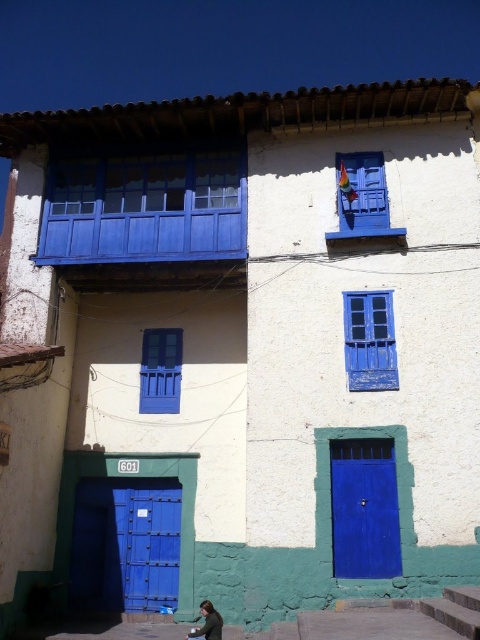
Question: Which is nearer to the matte blue wooden balcony at upper left?

Choices:
 (A) blue painted wood window at center
 (B) blue painted wood window at upper center
 (C) metallic blue door at lower left

Answer: (B)

Question: Which point is closer to the camera?

Choices:
 (A) blue painted wood window at center
 (B) matte blue wooden balcony at upper left
 (C) blue painted wood window at upper center
 (D) blue matte door at lower center

Answer: (D)

Question: Which point appears farthest from the camera in this image?

Choices:
 (A) (230, 240)
 (B) (160, 356)
 (C) (130, 580)
 (D) (384, 172)

Answer: (B)

Question: Is blue matte door at lower center positioned in front of matte blue window at center?

Choices:
 (A) no
 (B) yes

Answer: (B)

Question: Is blue painted wood window at center positioned at the back of blue painted wood window at upper center?

Choices:
 (A) yes
 (B) no

Answer: (B)

Question: Does blue matte door at lower center appear on the left side of blue painted wood window at upper center?

Choices:
 (A) yes
 (B) no

Answer: (A)